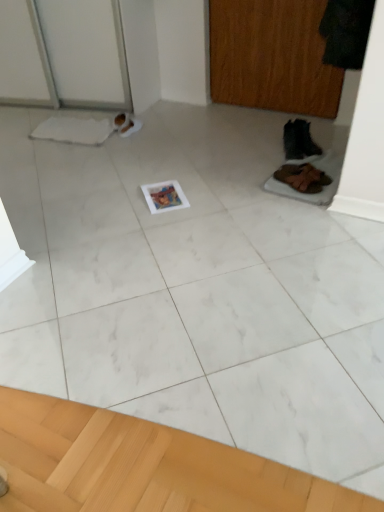
This screenshot has height=512, width=384. Find the location of `vacant space positioned to the left of black leather boot at right, the first footwear in the back-to-front sequence`. vacant space positioned to the left of black leather boot at right, the first footwear in the back-to-front sequence is located at coordinates (270, 150).